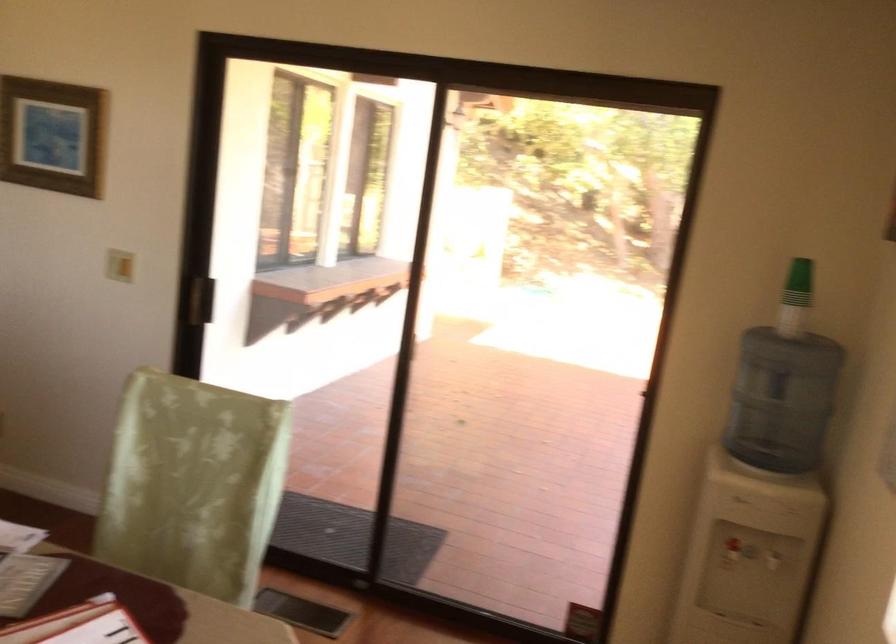
Locate an element on the screen. This screenshot has height=644, width=896. beige light switch is located at coordinates (119, 265).